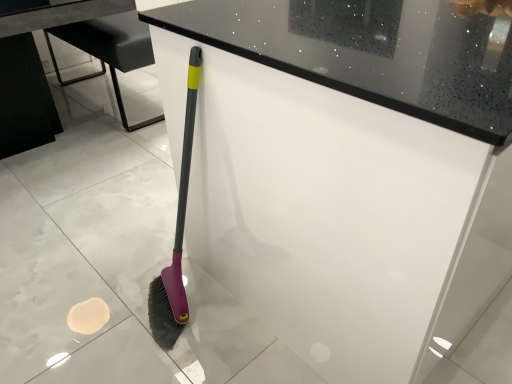
Question: Is metallic gray table at center shorter than black glossy table at lower left?

Choices:
 (A) no
 (B) yes

Answer: (B)

Question: Is metallic gray table at center wider than black glossy table at lower left?

Choices:
 (A) yes
 (B) no

Answer: (B)

Question: From a real-world perspective, is metallic gray table at center positioned under black glossy table at lower left based on gravity?

Choices:
 (A) yes
 (B) no

Answer: (A)

Question: Is metallic gray table at center outside black glossy table at lower left?

Choices:
 (A) no
 (B) yes

Answer: (A)

Question: From the image's perspective, does metallic gray table at center appear higher than black glossy table at lower left?

Choices:
 (A) no
 (B) yes

Answer: (B)

Question: From a real-world perspective, is white glossy counter at center positioned above or below metallic gray table at center?

Choices:
 (A) above
 (B) below

Answer: (A)

Question: Considering the positions of white glossy counter at center and metallic gray table at center in the image, is white glossy counter at center bigger or smaller than metallic gray table at center?

Choices:
 (A) small
 (B) big

Answer: (B)

Question: From the image's perspective, is white glossy counter at center located above or below metallic gray table at center?

Choices:
 (A) below
 (B) above

Answer: (A)

Question: Which is correct: white glossy counter at center is inside metallic gray table at center, or outside of it?

Choices:
 (A) inside
 (B) outside

Answer: (B)

Question: Is metallic gray table at center spatially inside white glossy counter at center, or outside of it?

Choices:
 (A) inside
 (B) outside

Answer: (B)

Question: In terms of size, does metallic gray table at center appear bigger or smaller than white glossy counter at center?

Choices:
 (A) big
 (B) small

Answer: (B)

Question: From a real-world perspective, is metallic gray table at center physically located above or below white glossy counter at center?

Choices:
 (A) above
 (B) below

Answer: (B)

Question: Is metallic gray table at center taller or shorter than white glossy counter at center?

Choices:
 (A) short
 (B) tall

Answer: (A)

Question: From the image's perspective, is black glossy table at lower left above or below white glossy counter at center?

Choices:
 (A) below
 (B) above

Answer: (B)

Question: In terms of height, does black glossy table at lower left look taller or shorter compared to white glossy counter at center?

Choices:
 (A) tall
 (B) short

Answer: (B)